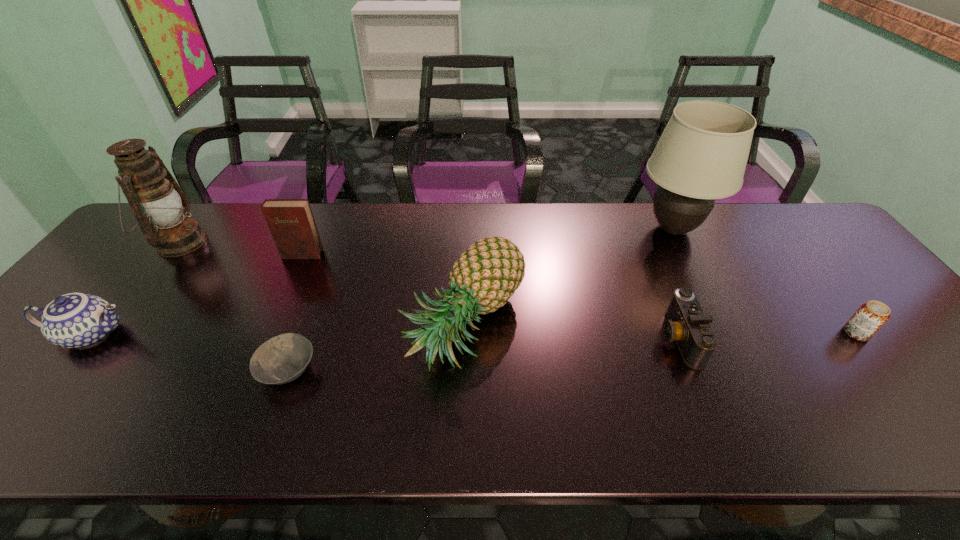
Image resolution: width=960 pixels, height=540 pixels. In order to click on blank region between the lantern and the shortest object in this screenshot , I will do `click(233, 306)`.

This screenshot has height=540, width=960. Identify the location of vacant space that's between the fifth object from left to right and the diary. (384, 289).

Locate an element on the screen. vacant area that lies between the rightmost object and the lampshade is located at coordinates (764, 281).

This screenshot has height=540, width=960. I want to click on vacant space in between the fourth object from right to left and the lampshade, so click(x=569, y=276).

Identify the location of free space between the fourth shortest object and the rightmost object. (474, 334).

At what (x,y) coordinates should I click in order to perform the action: click on vacant space that is in between the beer can and the camera. Please return your answer as a coordinate pair (x, y). The width and height of the screenshot is (960, 540). Looking at the image, I should click on (x=767, y=335).

Where is `vacant space that is in between the camera and the chinaware`? This screenshot has height=540, width=960. vacant space that is in between the camera and the chinaware is located at coordinates (385, 336).

Locate an element on the screen. object that is the second closest to the fifth object from left to right is located at coordinates (291, 222).

Identify which object is the fourth nearest to the shortest object. Please provide its 2D coordinates. Your answer should be formatted as a tuple, i.e. [(x, y)], where the tuple contains the x and y coordinates of a point satisfying the conditions above.

[(154, 196)]

This screenshot has height=540, width=960. In order to click on vacant area in the image that satisfies the following two spatial constraints: 1. on the front cover of the diary; 2. from the spout of the chinaware in this screenshot , I will do `click(268, 334)`.